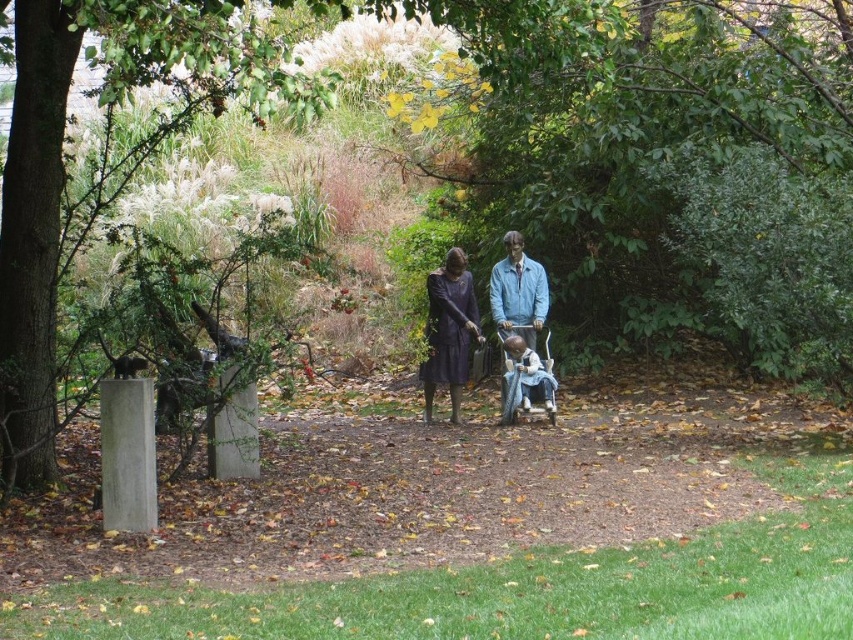
You are an artist planning to paint the scene. You have a canvas that can only accommodate objects up to the width of the green leafy tree at center. Will the matte purple dress at center fit on the canvas?

The green leafy tree at center might be wider than matte purple dress at center, so there is a possibility that the matte purple dress at center will fit on the canvas if the tree is indeed wider. However, since the exact width comparison is uncertain, it is advisable to check the actual dimensions before deciding.

You are a photographer setting up a shot of the sculpture. You want to ensure both the matte black dress at center and the wooden baby carriage at center are in focus. Which object should you position closer to the camera to achieve this?

The matte black dress at center might be wider than wooden baby carriage at center, so positioning the wider object closer to the camera would help both to be in focus.